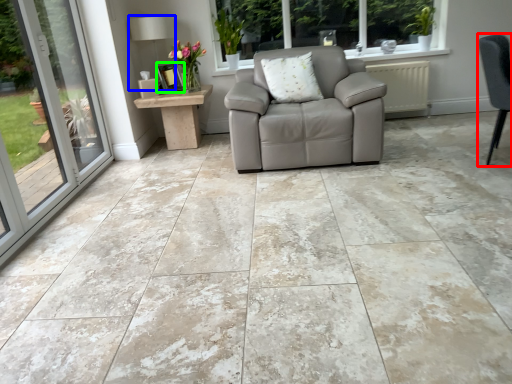
Question: Which object is positioned closest to chair (highlighted by a red box)? Select from lamp (highlighted by a blue box) and picture frame (highlighted by a green box).

Choices:
 (A) lamp
 (B) picture frame

Answer: (B)